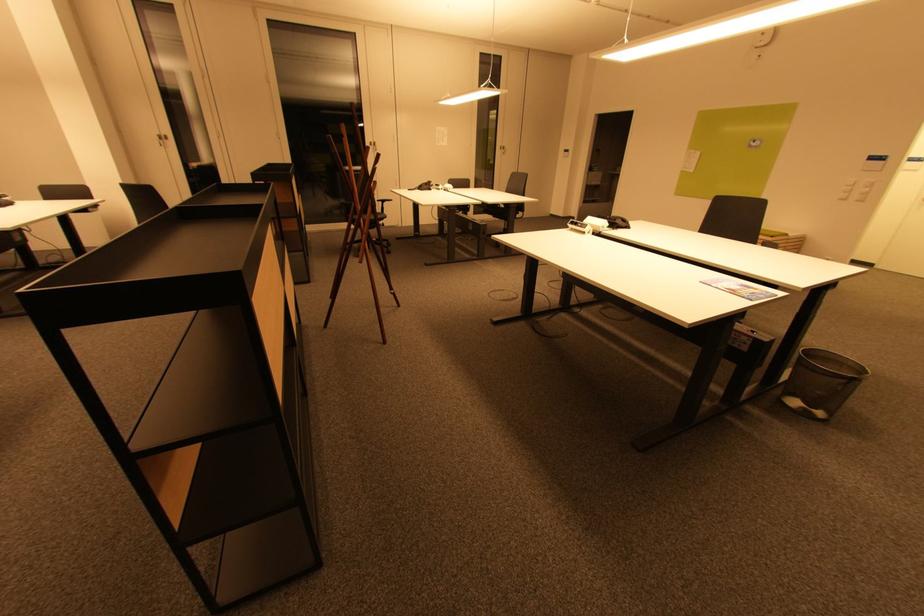
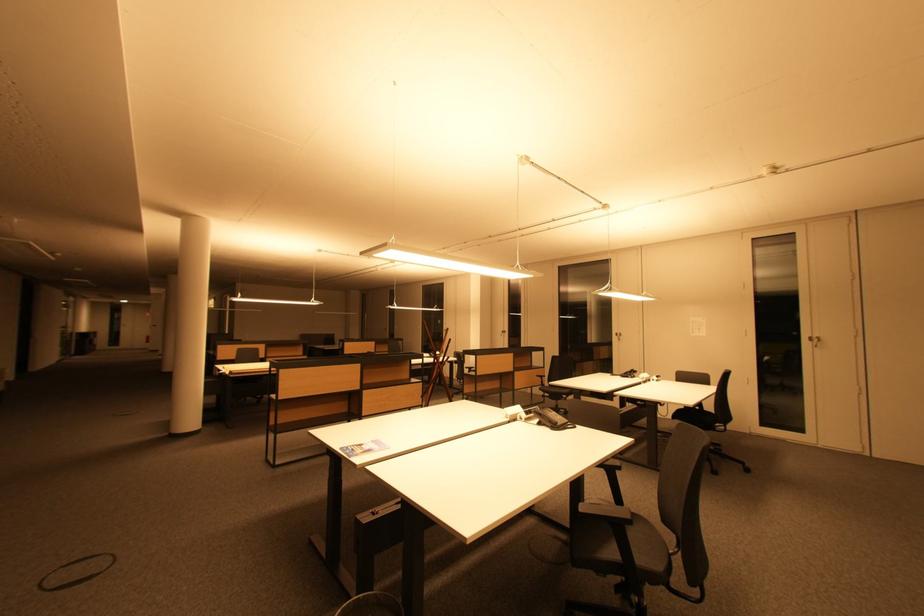
The point at [430,188] is marked in the first image. Where is the corresponding point in the second image?

(635, 376)